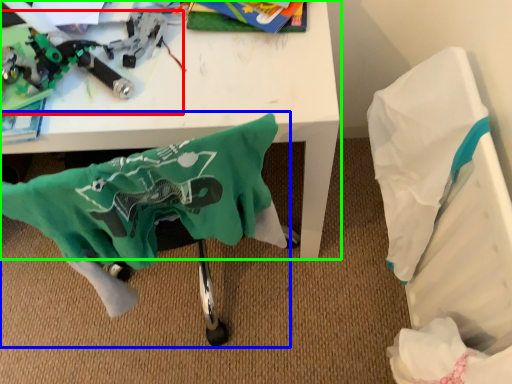
Question: Considering the real-world distances, which object is farthest from toy (highlighted by a red box)? swivel chair (highlighted by a blue box) or table (highlighted by a green box)?

Choices:
 (A) swivel chair
 (B) table

Answer: (A)